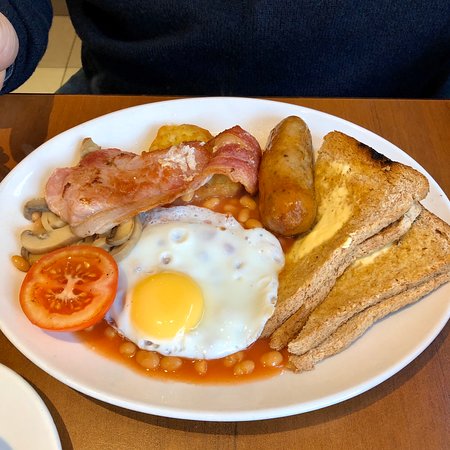
Identify the location of plate. The image size is (450, 450). (348, 123).